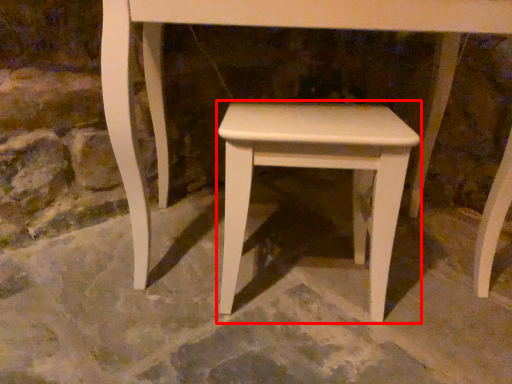
Question: From the image, what is the correct spatial relationship of stool (annotated by the red box) in relation to concrete?

Choices:
 (A) left
 (B) right

Answer: (B)